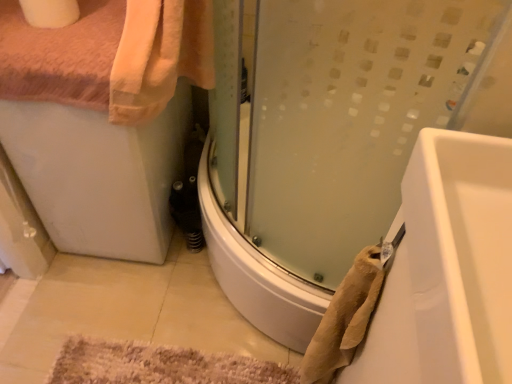
The image size is (512, 384). In order to click on free space above beige textured bath mat at lower center (from a real-world perspective) in this screenshot , I will do `click(168, 364)`.